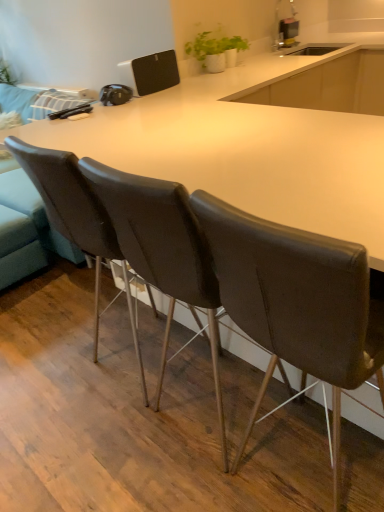
Find the location of `free space to the left of leather at center, the 2th chair positioned from the right`. free space to the left of leather at center, the 2th chair positioned from the right is located at coordinates [x=113, y=444].